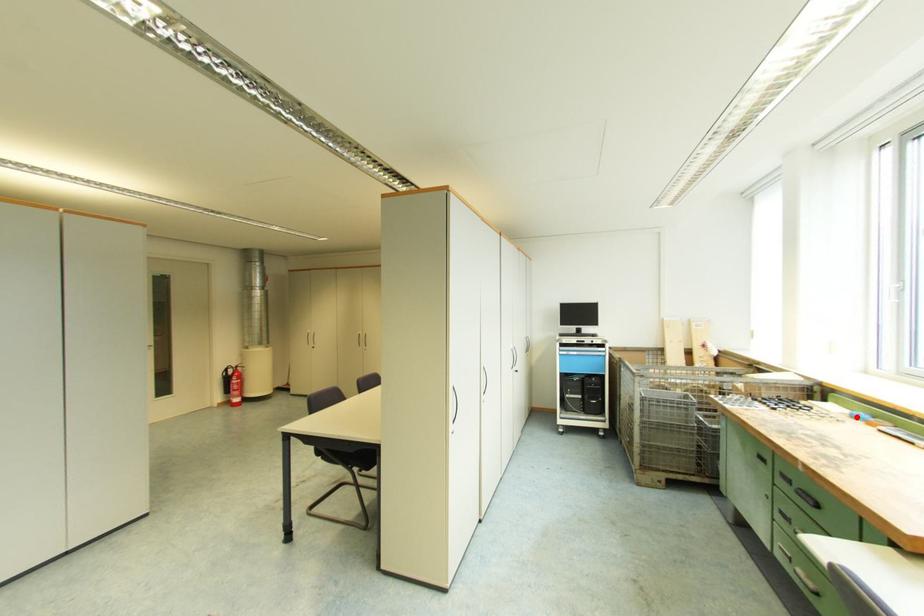
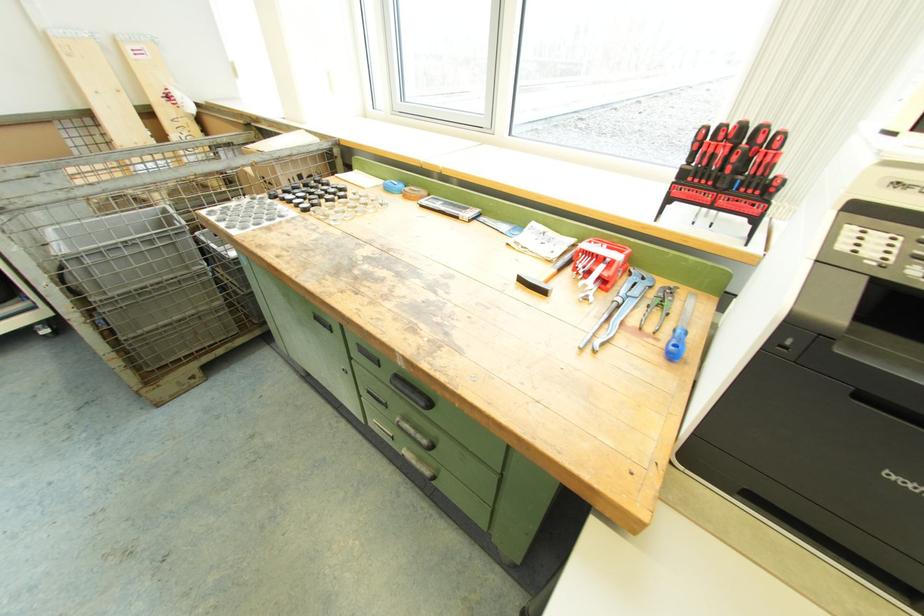
Question: I am providing you with two images of the same scene from different viewpoints. A red point is shown in image1. For the corresponding object point in image2, is it positioned nearer or farther from the camera?

Choices:
 (A) Nearer
 (B) Farther

Answer: (A)